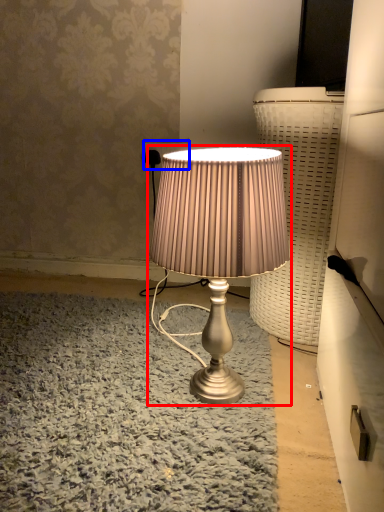
Question: Which point is closer to the camera, lamp (highlighted by a red box) or electric outlet (highlighted by a blue box)?

Choices:
 (A) lamp
 (B) electric outlet

Answer: (A)